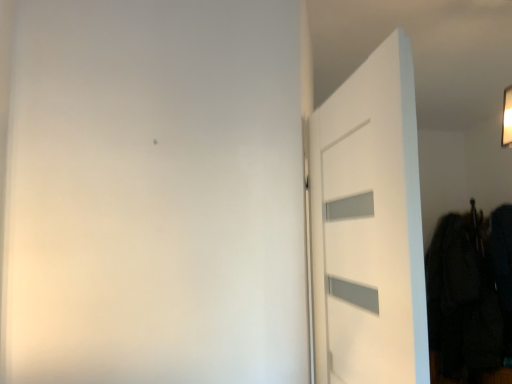
This screenshot has height=384, width=512. What do you see at coordinates (470, 297) in the screenshot? I see `dark fabric coat at right` at bounding box center [470, 297].

Find the location of a particular element. dark fabric coat at right is located at coordinates (x=470, y=297).

You are a GUI agent. You are given a task and a screenshot of the screen. Output one action in this format:
    pyautogui.click(x=<x>, y=<y>)
    Task: Click on the white matte door at right
    
    Given the screenshot: What is the action you would take?
    pyautogui.click(x=368, y=226)

Describe the element at coordinates (368, 226) in the screenshot. I see `white matte door at right` at that location.

You are a GUI agent. You are given a task and a screenshot of the screen. Output one action in this format:
    pyautogui.click(x=<x>, y=<y>)
    Task: Click on the dark fabric coat at right
    The width and height of the screenshot is (512, 384).
    Given the screenshot: What is the action you would take?
    pyautogui.click(x=470, y=297)

Which object is positioned more to the right, white matte door at right or dark fabric coat at right?

dark fabric coat at right is more to the right.

Considering the positions of objects white matte door at right and dark fabric coat at right in the image provided, who is behind, white matte door at right or dark fabric coat at right?

dark fabric coat at right is more distant.

Which point is more distant from viewer, (347,88) or (504,382)?

Point (504,382)

From the image's perspective, which is above, white matte door at right or dark fabric coat at right?

From the image's view, white matte door at right is above.

From a real-world perspective, which is physically above, white matte door at right or dark fabric coat at right?

white matte door at right.

Which object is wider, white matte door at right or dark fabric coat at right?

With larger width is dark fabric coat at right.

Can you confirm if white matte door at right is shorter than dark fabric coat at right?

Yes.

Consider the image. Is white matte door at right bigger than dark fabric coat at right?

No.

Would you say dark fabric coat at right is part of white matte door at right's contents?

No, white matte door at right does not contain dark fabric coat at right.

Based on the photo, are white matte door at right and dark fabric coat at right far apart?

That's right, there is a large distance between white matte door at right and dark fabric coat at right.

Could you tell me if white matte door at right is facing dark fabric coat at right?

No, white matte door at right is not aimed at dark fabric coat at right.

What's the angular difference between white matte door at right and dark fabric coat at right's facing directions?

The angle between the facing direction of white matte door at right and the facing direction of dark fabric coat at right is 93.2 degrees.

How distant is white matte door at right from dark fabric coat at right?

They are 2.34 meters apart.

Where is `clothing below the white matte door at right (from a real-world perspective)`? clothing below the white matte door at right (from a real-world perspective) is located at coordinates (470, 297).

Which object is positioned more to the left, dark fabric coat at right or white matte door at right?

From the viewer's perspective, white matte door at right appears more on the left side.

Is dark fabric coat at right behind white matte door at right?

Yes, it is behind white matte door at right.

Which is in front, point (473, 204) or point (321, 134)?

The point (321, 134) is closer.

In the scene shown: From the image's perspective, who appears lower, dark fabric coat at right or white matte door at right?

dark fabric coat at right is shown below in the image.

Based on the photo, from a real-world perspective, is dark fabric coat at right positioned over white matte door at right based on gravity?

Actually, dark fabric coat at right is physically below white matte door at right in the real world.

Can you confirm if dark fabric coat at right is wider than white matte door at right?

Correct, the width of dark fabric coat at right exceeds that of white matte door at right.

Consider the image. Which of these two, dark fabric coat at right or white matte door at right, stands taller?

Standing taller between the two is dark fabric coat at right.

Who is bigger, dark fabric coat at right or white matte door at right?

dark fabric coat at right.

Is dark fabric coat at right inside or outside of white matte door at right?

dark fabric coat at right is located beyond the bounds of white matte door at right.

Is dark fabric coat at right far from white matte door at right?

Indeed, dark fabric coat at right is not near white matte door at right.

Is dark fabric coat at right oriented away from white matte door at right?

No, dark fabric coat at right is not facing away from white matte door at right.

From the picture: How many degrees apart are the facing directions of dark fabric coat at right and white matte door at right?

There is a 93.2-degree angle between the facing directions of dark fabric coat at right and white matte door at right.

Where is `clothing on the right of white matte door at right`? The height and width of the screenshot is (384, 512). clothing on the right of white matte door at right is located at coordinates tap(470, 297).

At what (x,y) coordinates should I click in order to perform the action: click on clothing directly beneath the white matte door at right (from a real-world perspective). Please return your answer as a coordinate pair (x, y). Looking at the image, I should click on (470, 297).

The height and width of the screenshot is (384, 512). In order to click on door above the dark fabric coat at right (from the image's perspective) in this screenshot , I will do `click(368, 226)`.